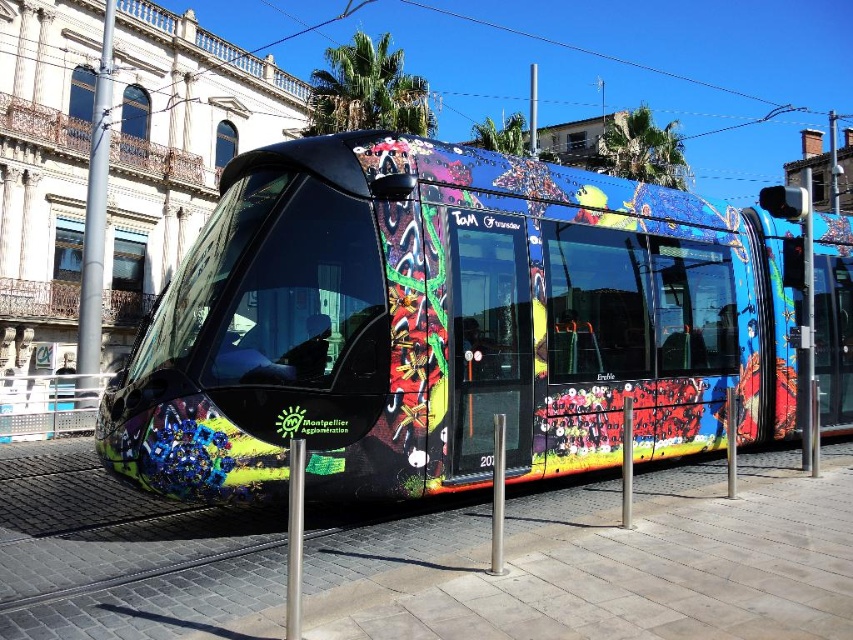
Question: Which of the following is the farthest from the observer?

Choices:
 (A) (86, 260)
 (B) (241, 376)

Answer: (A)

Question: Can you confirm if multicolored graffiti train at center is smaller than silver metallic pole at left?

Choices:
 (A) no
 (B) yes

Answer: (A)

Question: Does multicolored graffiti train at center have a larger size compared to silver metallic pole at left?

Choices:
 (A) yes
 (B) no

Answer: (A)

Question: Which point is closer to the camera?

Choices:
 (A) (85, 339)
 (B) (599, 432)

Answer: (B)

Question: Which of the following is the farthest from the observer?

Choices:
 (A) (445, 406)
 (B) (93, 257)

Answer: (B)

Question: Considering the relative positions of multicolored graffiti train at center and silver metallic pole at left in the image provided, where is multicolored graffiti train at center located with respect to silver metallic pole at left?

Choices:
 (A) below
 (B) above

Answer: (A)